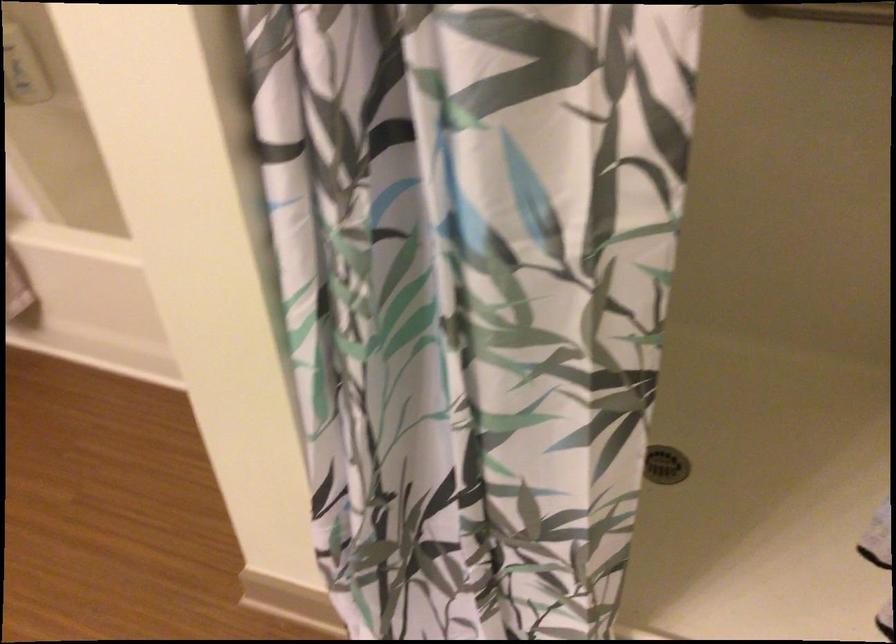
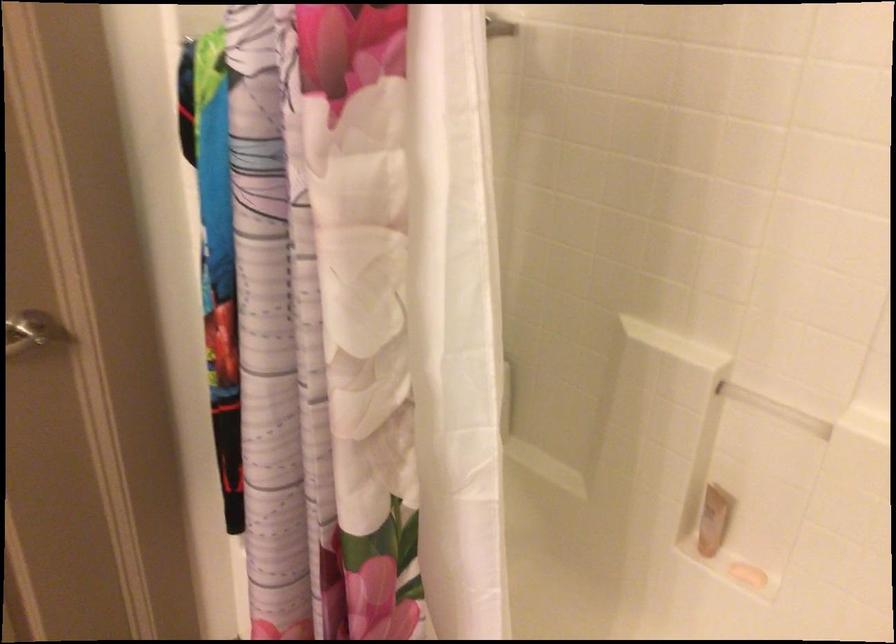
Which direction would the cameraman need to move to produce the second image?

The cameraman walked toward left, forward.